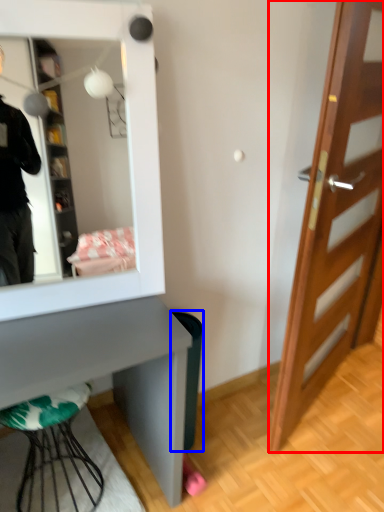
Question: Which object appears closest to the camera in this image, door (highlighted by a red box) or trash bin/can (highlighted by a blue box)?

Choices:
 (A) door
 (B) trash bin/can

Answer: (A)